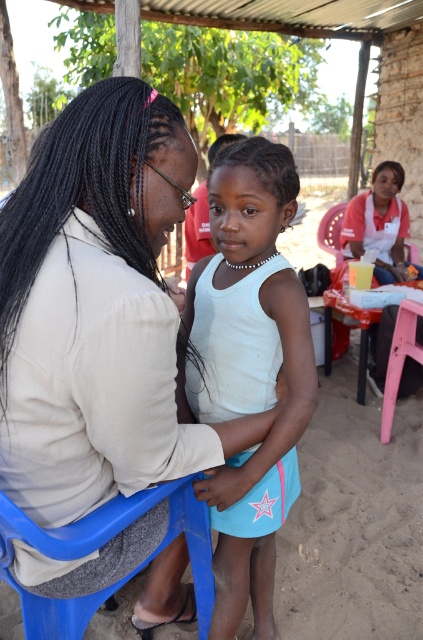
You are planning to set up a small outdoor event and need to know if the blue plastic chair at lower left can fit in the space allocated for it, which is the same size as the white fabric shirt at upper right. Will it fit?

The blue plastic chair at lower left occupies less space than the white fabric shirt at upper right, so it will fit in the allocated space.

You are standing at the origin point in the image. Which object is located at coordinates point (98, 547)?

The point (98, 547) marks the location of the blue plastic chair at lower left.

Looking at this image, you are a photographer positioned at the center of the scene. You want to capture a photo that includes both the matte beige shirt at center and the white fabric shirt at upper right. The camera has a maximum focal length that allows capturing objects up to 3 meters apart. Will you be able to include both subjects in the frame?

The matte beige shirt at center and white fabric shirt at upper right are 3.15 meters apart, which exceeds the camera maximum focal length of 3 meters. Therefore, you cannot include both subjects in the frame.